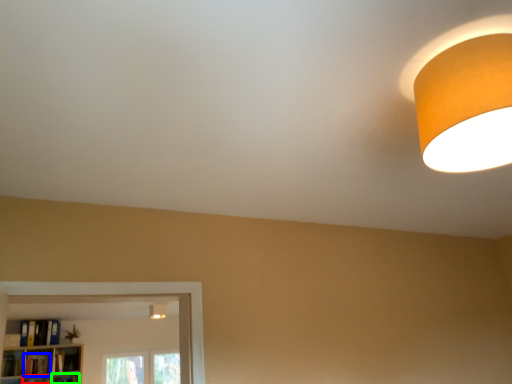
Question: Which object is the farthest from shelf (highlighted by a red box)? Choose among these: book (highlighted by a blue box) or shelf (highlighted by a green box).

Choices:
 (A) book
 (B) shelf

Answer: (B)